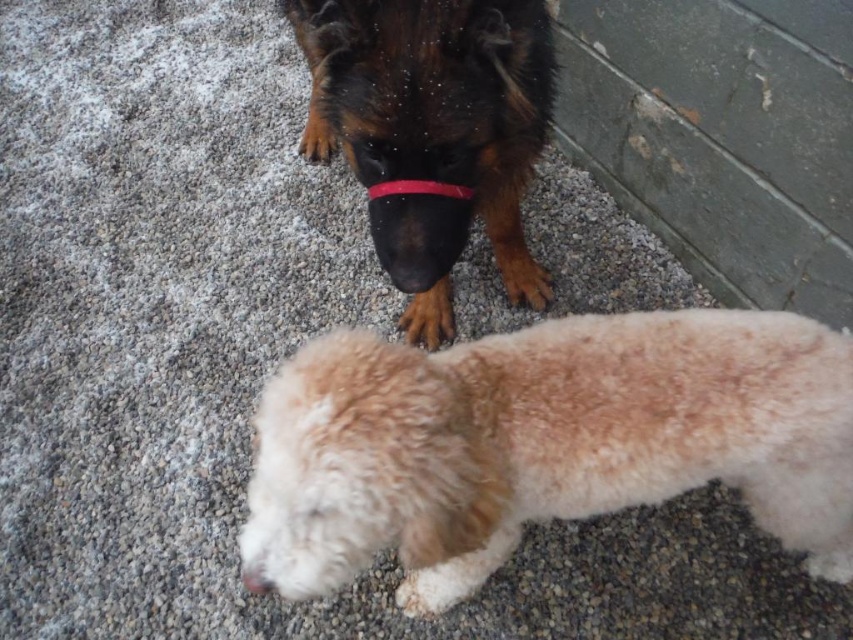
You are a photographer standing 3 feet away from the white fluffy dog at lower center. Can you safely take a photo without getting too close to the dog?

The white fluffy dog at lower center is 29.12 inches away from the viewer, which is approximately 2.43 feet. Since you are standing 3 feet away, you are slightly farther than the dog, so you can safely take a photo without getting too close to the dog.

You are a photographer trying to capture a photo of both the white fluffy dog at lower center and the brown furry dog at upper center. Which dog should you adjust your camera angle to focus on first if you want to ensure both are in frame?

You should focus on the brown furry dog at upper center first because the white fluffy dog at lower center is to the right of it, so adjusting from the left to right would keep both in frame.